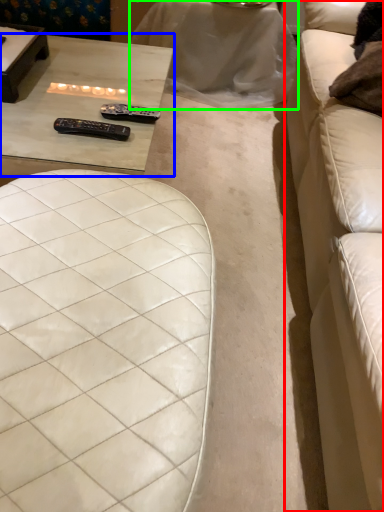
Question: Considering the real-world distances, which object is closest to studio couch (highlighted by a red box)? table (highlighted by a blue box) or table (highlighted by a green box).

Choices:
 (A) table
 (B) table

Answer: (B)